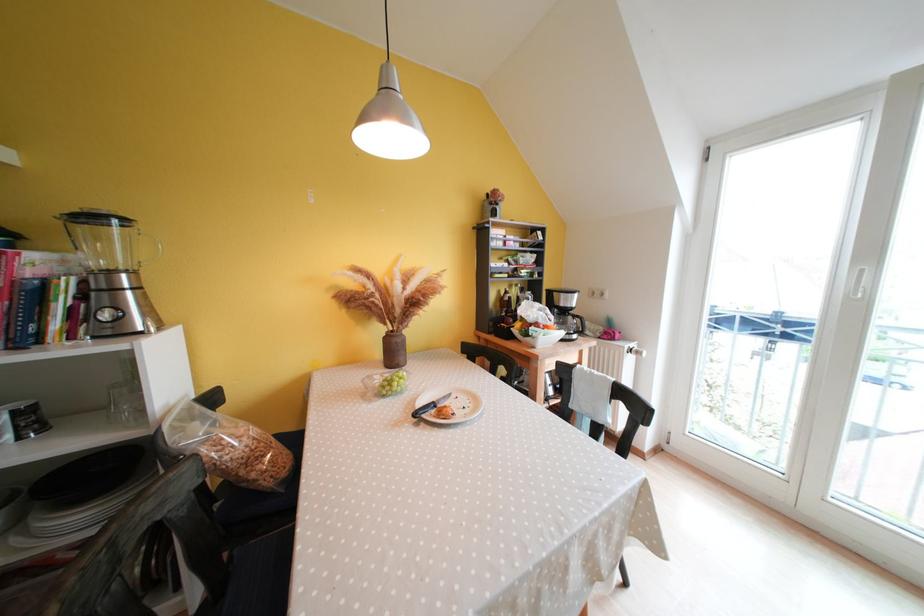
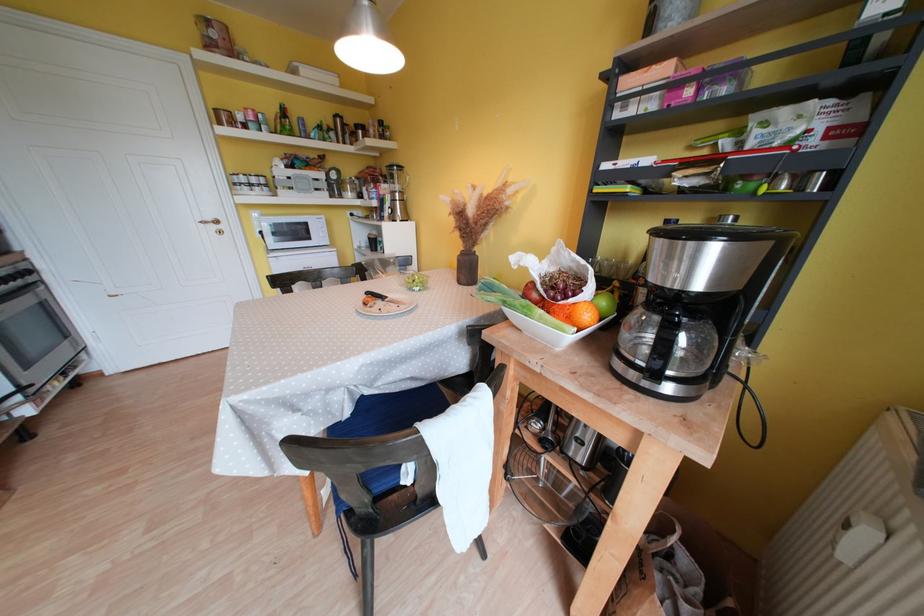
The point at (399, 357) is marked in the first image. Where is the corresponding point in the second image?

(472, 275)